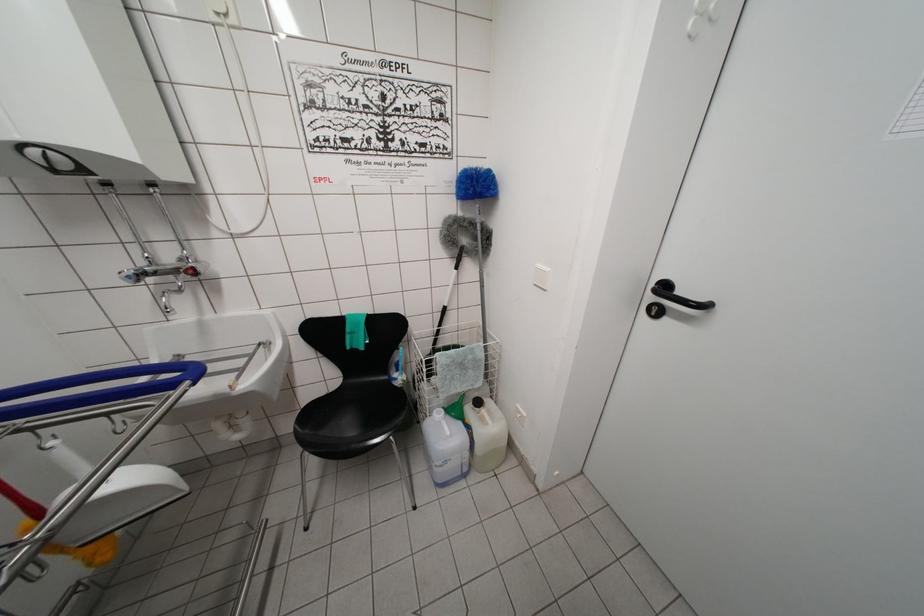
The height and width of the screenshot is (616, 924). What do you see at coordinates (190, 270) in the screenshot?
I see `a red faucet knob` at bounding box center [190, 270].